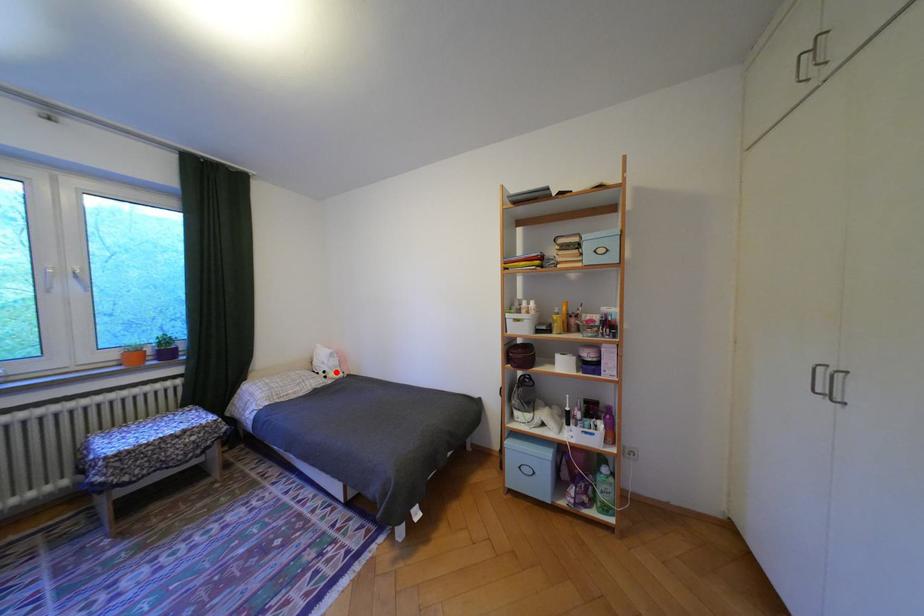
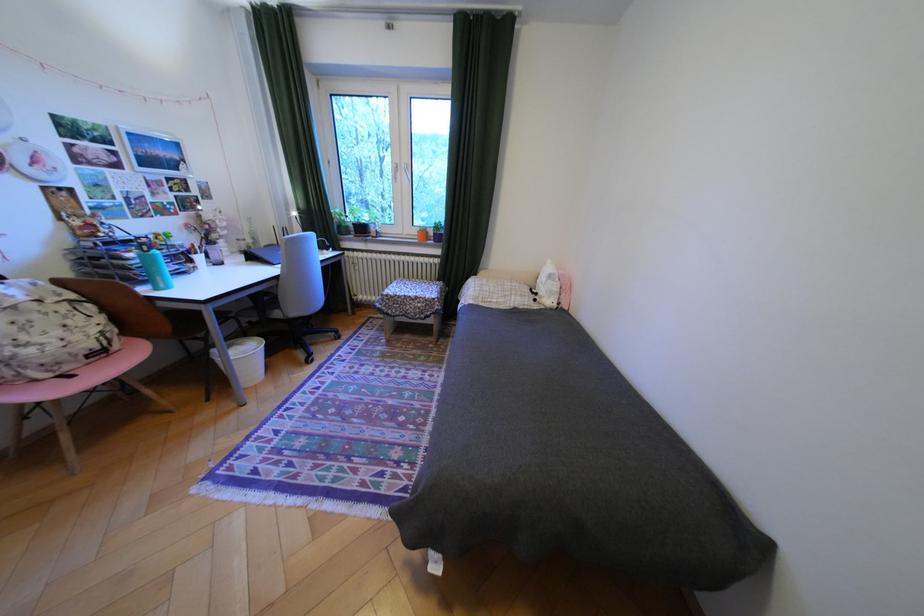
The point at the highlighted location is marked in the first image. Where is the corresponding point in the second image?

(548, 294)